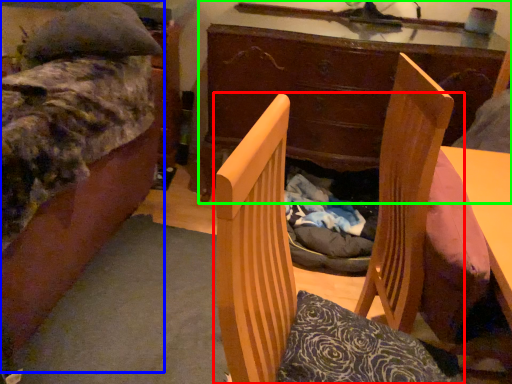
Question: Estimate the real-world distances between objects in this image. Which object is closer to chair (highlighted by a red box), bed (highlighted by a blue box) or desk (highlighted by a green box)?

Choices:
 (A) bed
 (B) desk

Answer: (A)